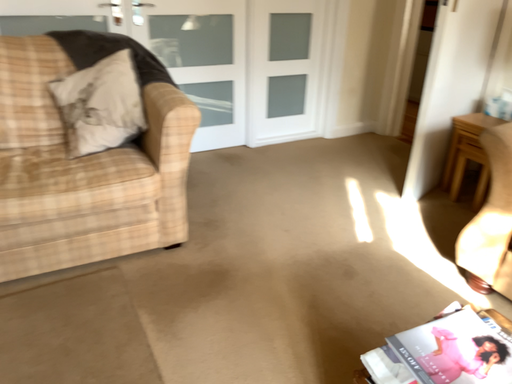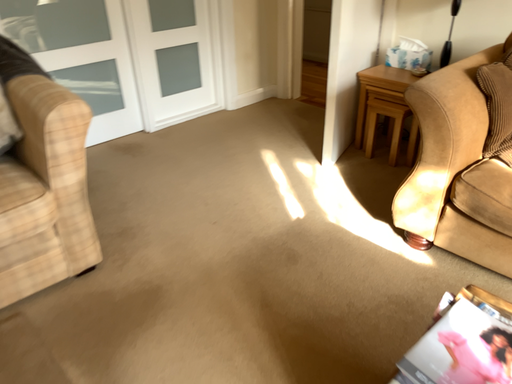
Question: Which way did the camera rotate in the video?

Choices:
 (A) rotated right
 (B) rotated left

Answer: (A)